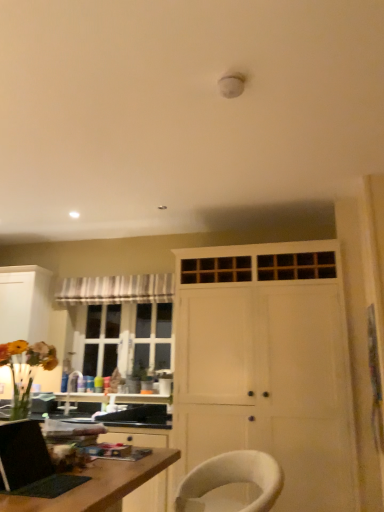
Describe the element at coordinates (232, 480) in the screenshot. This screenshot has height=512, width=384. I see `white fabric chair at lower center` at that location.

This screenshot has width=384, height=512. I want to click on striped fabric curtain at upper left, so click(116, 289).

From the picture: What is the approximate width of striped fabric curtain at upper left?

striped fabric curtain at upper left is 4.26 inches wide.

Measure the distance between point (2, 310) and camera.

The depth of point (2, 310) is 4.16 meters.

Measure the distance between matte black laptop at lower left and camera.

1.36 meters.

Where is `wooden desk at lower left`? Image resolution: width=384 pixels, height=512 pixels. wooden desk at lower left is located at coordinates (98, 485).

Looking at this image, from the image's perspective, is wooden desk at lower left located above striped fabric curtain at upper left?

Actually, wooden desk at lower left appears below striped fabric curtain at upper left in the image.

Considering the relative sizes of wooden desk at lower left and striped fabric curtain at upper left in the image provided, is wooden desk at lower left taller than striped fabric curtain at upper left?

Yes, wooden desk at lower left is taller than striped fabric curtain at upper left.

Consider the image. Considering their positions, is wooden desk at lower left located in front of or behind striped fabric curtain at upper left?

wooden desk at lower left is positioned closer to the viewer than striped fabric curtain at upper left.

Considering the relative sizes of wooden desk at lower left and striped fabric curtain at upper left in the image provided, is wooden desk at lower left smaller than striped fabric curtain at upper left?

No, wooden desk at lower left is not smaller than striped fabric curtain at upper left.

How far apart are white matte cabinet at left, the first cabinetry when ordered from left to right, and striped fabric curtain at upper left?

The distance of white matte cabinet at left, the first cabinetry when ordered from left to right, from striped fabric curtain at upper left is 24.00 inches.

Is white matte cabinet at left, the first cabinetry when ordered from left to right, not inside striped fabric curtain at upper left?

That's correct, white matte cabinet at left, the first cabinetry when ordered from left to right, is outside of striped fabric curtain at upper left.

Considering the relative sizes of white matte cabinet at left, the first cabinetry when ordered from left to right, and striped fabric curtain at upper left in the image provided, is white matte cabinet at left, the first cabinetry when ordered from left to right, smaller than striped fabric curtain at upper left?

No.

Does white matte cabinet at left, marked as the 2th cabinetry in a right-to-left arrangement, have a greater height compared to striped fabric curtain at upper left?

Indeed, white matte cabinet at left, marked as the 2th cabinetry in a right-to-left arrangement, has a greater height compared to striped fabric curtain at upper left.

Which of these two, wooden desk at lower left or white fabric chair at lower center, is smaller?

white fabric chair at lower center is smaller.

Does wooden desk at lower left touch white fabric chair at lower center?

No, wooden desk at lower left is not touching white fabric chair at lower center.

Is point (168, 464) positioned behind point (220, 470)?

No, it is in front of (220, 470).

You are a GUI agent. You are given a task and a screenshot of the screen. Output one action in this format:
    pyautogui.click(x=<x>, y=<y>)
    Task: Click on the curtain above the wooden desk at lower left (from a real-world perspective)
    The height and width of the screenshot is (512, 384).
    Given the screenshot: What is the action you would take?
    pyautogui.click(x=116, y=289)

How much distance is there between striped fabric curtain at upper left and wooden desk at lower left?

The distance of striped fabric curtain at upper left from wooden desk at lower left is 8.14 feet.

Considering the positions of objects striped fabric curtain at upper left and wooden desk at lower left in the image provided, who is in front, striped fabric curtain at upper left or wooden desk at lower left?

wooden desk at lower left.

Is striped fabric curtain at upper left with wooden desk at lower left?

No, striped fabric curtain at upper left is not with wooden desk at lower left.

Between point (271, 480) and point (122, 476), which one is positioned in front?

The point (122, 476) is in front.

Between white fabric chair at lower center and wooden desk at lower left, which one appears on the left side from the viewer's perspective?

wooden desk at lower left.

The image size is (384, 512). What are the coordinates of `chair located underneath the wooden desk at lower left (from a real-world perspective)` in the screenshot? It's located at (232, 480).

Between white fabric chair at lower center and wooden desk at lower left, which one has more height?

Standing taller between the two is wooden desk at lower left.

From the image's perspective, is white wood cabinet at center, which ranks as the 2th cabinetry in left-to-right order, located above or below white fabric chair at lower center?

white wood cabinet at center, which ranks as the 2th cabinetry in left-to-right order, is above white fabric chair at lower center.

From a real-world perspective, is white wood cabinet at center, the first cabinetry in the right-to-left sequence, positioned above or below white fabric chair at lower center?

white wood cabinet at center, the first cabinetry in the right-to-left sequence, is above white fabric chair at lower center.

Is white fabric chair at lower center a part of white wood cabinet at center, marked as the 2th cabinetry in a back-to-front arrangement?

Definitely not — white fabric chair at lower center is not inside white wood cabinet at center, marked as the 2th cabinetry in a back-to-front arrangement.

Which is more to the right, matte black laptop at lower left or striped fabric curtain at upper left?

From the viewer's perspective, matte black laptop at lower left appears more on the right side.

Which object is more forward, matte black laptop at lower left or striped fabric curtain at upper left?

matte black laptop at lower left is more forward.

Does point (29, 489) appear closer or farther from the camera than point (70, 298)?

Point (29, 489) appears to be closer to the viewer than point (70, 298).

Find the location of a particular element. curtain lying above the wooden desk at lower left (from the image's perspective) is located at coordinates (116, 289).

Which cabinetry is the 1st one when counting from the front of the striped fabric curtain at upper left? Please provide its 2D coordinates.

[(24, 303)]

Looking at the image, which one is located closer to white matte cabinet at left, the 1th cabinetry positioned from the back, white fabric chair at lower center or striped fabric curtain at upper left?

Based on the image, striped fabric curtain at upper left appears to be nearer to white matte cabinet at left, the 1th cabinetry positioned from the back.

Estimate the real-world distances between objects in this image. Which object is closer to striped fabric curtain at upper left, matte black laptop at lower left or white matte cabinet at left, which appears as the second cabinetry when viewed from the front?

Among the two, white matte cabinet at left, which appears as the second cabinetry when viewed from the front, is located nearer to striped fabric curtain at upper left.

Based on their spatial positions, is white fabric chair at lower center or striped fabric curtain at upper left closer to white wood cabinet at center, which ranks as the 2th cabinetry in left-to-right order?

Among the two, white fabric chair at lower center is located nearer to white wood cabinet at center, which ranks as the 2th cabinetry in left-to-right order.

Estimate the real-world distances between objects in this image. Which object is further from white matte cabinet at left, which appears as the second cabinetry when viewed from the front, white wood cabinet at center, the first cabinetry in the right-to-left sequence, or wooden desk at lower left?

Among the two, wooden desk at lower left is located further to white matte cabinet at left, which appears as the second cabinetry when viewed from the front.

Consider the image. From the image, which object appears to be nearer to wooden desk at lower left, matte black laptop at lower left or striped fabric curtain at upper left?

matte black laptop at lower left is positioned closer to the anchor wooden desk at lower left.

Estimate the real-world distances between objects in this image. Which object is closer to wooden desk at lower left, white matte cabinet at left, the 1th cabinetry positioned from the back, or striped fabric curtain at upper left?

striped fabric curtain at upper left is positioned closer to the anchor wooden desk at lower left.

Based on their spatial positions, is wooden desk at lower left or striped fabric curtain at upper left closer to white wood cabinet at center, marked as the 2th cabinetry in a back-to-front arrangement?

The object closer to white wood cabinet at center, marked as the 2th cabinetry in a back-to-front arrangement, is striped fabric curtain at upper left.

From the image, which object appears to be nearer to white fabric chair at lower center, striped fabric curtain at upper left or white matte cabinet at left, the first cabinetry when ordered from left to right?

striped fabric curtain at upper left lies closer to white fabric chair at lower center than the other object.

This screenshot has width=384, height=512. Identify the location of laptop positioned between wooden desk at lower left and striped fabric curtain at upper left from near to far. (30, 463).

At what (x,y) coordinates should I click in order to perform the action: click on laptop positioned between wooden desk at lower left and white wood cabinet at center, the first cabinetry in the front-to-back sequence, from near to far. Please return your answer as a coordinate pair (x, y). This screenshot has height=512, width=384. Looking at the image, I should click on (30, 463).

Where is `chair between wooden desk at lower left and white matte cabinet at left, marked as the 2th cabinetry in a right-to-left arrangement, along the z-axis`? chair between wooden desk at lower left and white matte cabinet at left, marked as the 2th cabinetry in a right-to-left arrangement, along the z-axis is located at coordinates (232, 480).

At what (x,y) coordinates should I click in order to perform the action: click on cabinetry between matte black laptop at lower left and white matte cabinet at left, the 1th cabinetry positioned from the back, along the z-axis. Please return your answer as a coordinate pair (x, y). This screenshot has height=512, width=384. Looking at the image, I should click on (267, 367).